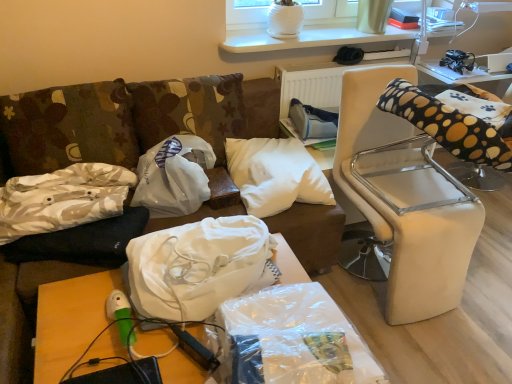
Question: Is wooden table at lower left, the 2th table from the back, taller than white plastic bag at center, which is the 1th material in back-to-front order?

Choices:
 (A) no
 (B) yes

Answer: (B)

Question: Is wooden table at lower left, placed as the second table when sorted from top to bottom, further to the viewer compared to white plastic bag at center, placed as the third material when sorted from front to back?

Choices:
 (A) no
 (B) yes

Answer: (A)

Question: Is wooden table at lower left, acting as the 1th table starting from the bottom, positioned before white plastic bag at center, placed as the third material when sorted from front to back?

Choices:
 (A) no
 (B) yes

Answer: (B)

Question: Is wooden table at lower left, placed as the second table when sorted from top to bottom, next to white plastic bag at center, which is the 1th material in back-to-front order, and touching it?

Choices:
 (A) yes
 (B) no

Answer: (B)

Question: From a real-world perspective, is wooden table at lower left, the 2th table from the back, physically above white plastic bag at center, which is the 1th material in back-to-front order?

Choices:
 (A) yes
 (B) no

Answer: (B)

Question: Is wooden table at lower left, the 2th table from the back, thinner than white plastic bag at center, placed as the third material when sorted from front to back?

Choices:
 (A) no
 (B) yes

Answer: (A)

Question: Is white leather chair at right not inside camouflage fabric pillow at left, the second pillow positioned from the left?

Choices:
 (A) yes
 (B) no

Answer: (A)

Question: Is camouflage fabric pillow at left, the second pillow positioned from the left, a part of white leather chair at right?

Choices:
 (A) yes
 (B) no

Answer: (B)

Question: Does white leather chair at right appear on the left side of camouflage fabric pillow at left, the second pillow positioned from the left?

Choices:
 (A) yes
 (B) no

Answer: (B)

Question: Does white leather chair at right turn towards camouflage fabric pillow at left, positioned as the second pillow in right-to-left order?

Choices:
 (A) no
 (B) yes

Answer: (A)

Question: Does white leather chair at right have a lesser height compared to camouflage fabric pillow at left, the second pillow positioned from the left?

Choices:
 (A) yes
 (B) no

Answer: (B)

Question: Considering the relative sizes of white leather chair at right and camouflage fabric pillow at left, the second pillow positioned from the left, in the image provided, is white leather chair at right wider than camouflage fabric pillow at left, the second pillow positioned from the left,?

Choices:
 (A) no
 (B) yes

Answer: (B)

Question: From the image's perspective, is white fabric bag at center, which is the 2th material in back-to-front order, below clear plastic bag at lower center, which ranks as the 1th material in front-to-back order?

Choices:
 (A) yes
 (B) no

Answer: (B)